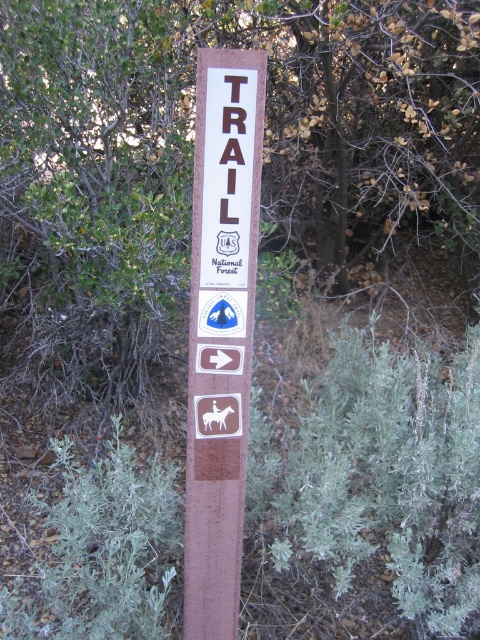
You are a hiker trying to read the brown wood trail sign at center while standing next to the green leafy tree at center. Which object would block your view of the sign if you are standing directly in front of them?

The green leafy tree at center is larger in size than the brown wood trail sign at center, so it would block your view of the sign if you are standing directly in front of them.

You are standing at the base of the wooden trail marker post and want to take a photo of the green leafy tree at center. Which direction should you face to capture it in your camera?

The green leafy tree at center is located at point coordinates of 0.255 on the x axis and 0.398 on the y axis. Since the coordinates are less than 0.5, the tree is positioned to the left and above the center point of the scene. Therefore, you should face slightly to the left and upwards from the trail marker post to capture the tree in your photo.